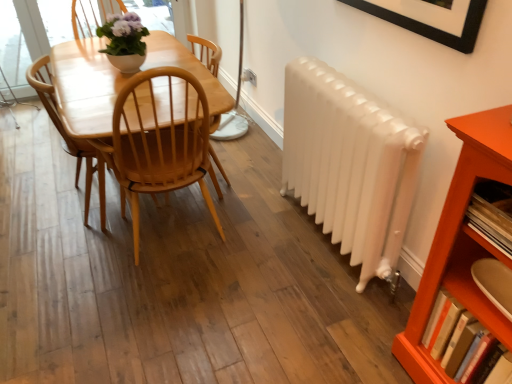
Question: From a real-world perspective, is wooden bookshelf at right, placed as the second book when sorted from bottom to top, on matte white pot at upper center?

Choices:
 (A) no
 (B) yes

Answer: (A)

Question: Is wooden bookshelf at right, the 1th book viewed from the top, at the left side of matte white pot at upper center?

Choices:
 (A) yes
 (B) no

Answer: (B)

Question: Is the position of wooden bookshelf at right, the 1th book viewed from the top, more distant than that of matte white pot at upper center?

Choices:
 (A) no
 (B) yes

Answer: (A)

Question: Does wooden bookshelf at right, placed as the second book when sorted from bottom to top, lie in front of matte white pot at upper center?

Choices:
 (A) no
 (B) yes

Answer: (B)

Question: Is wooden bookshelf at right, the 1th book viewed from the top, facing away from matte white pot at upper center?

Choices:
 (A) yes
 (B) no

Answer: (B)

Question: Does wooden bookshelf at right, the 1th book viewed from the top, have a smaller size compared to matte white pot at upper center?

Choices:
 (A) yes
 (B) no

Answer: (A)

Question: Is wooden bookshelf at right, placed as the second book when sorted from bottom to top, oriented towards orange wood shelf at lower right?

Choices:
 (A) no
 (B) yes

Answer: (B)

Question: Is wooden bookshelf at right, the 1th book viewed from the top, in front of orange wood shelf at lower right?

Choices:
 (A) no
 (B) yes

Answer: (A)

Question: Considering the relative positions of wooden bookshelf at right, placed as the second book when sorted from bottom to top, and orange wood shelf at lower right in the image provided, is wooden bookshelf at right, placed as the second book when sorted from bottom to top, to the left of orange wood shelf at lower right from the viewer's perspective?

Choices:
 (A) no
 (B) yes

Answer: (B)

Question: Can you confirm if wooden bookshelf at right, placed as the second book when sorted from bottom to top, is wider than orange wood shelf at lower right?

Choices:
 (A) yes
 (B) no

Answer: (B)

Question: From the image's perspective, is wooden bookshelf at right, the 1th book viewed from the top, located above orange wood shelf at lower right?

Choices:
 (A) no
 (B) yes

Answer: (B)

Question: Is wooden bookshelf at right, the 1th book viewed from the top, shorter than orange wood shelf at lower right?

Choices:
 (A) no
 (B) yes

Answer: (B)

Question: From the image's perspective, is white glossy radiator at right over wooden bookshelf at right, placed as the second book when sorted from bottom to top?

Choices:
 (A) no
 (B) yes

Answer: (B)